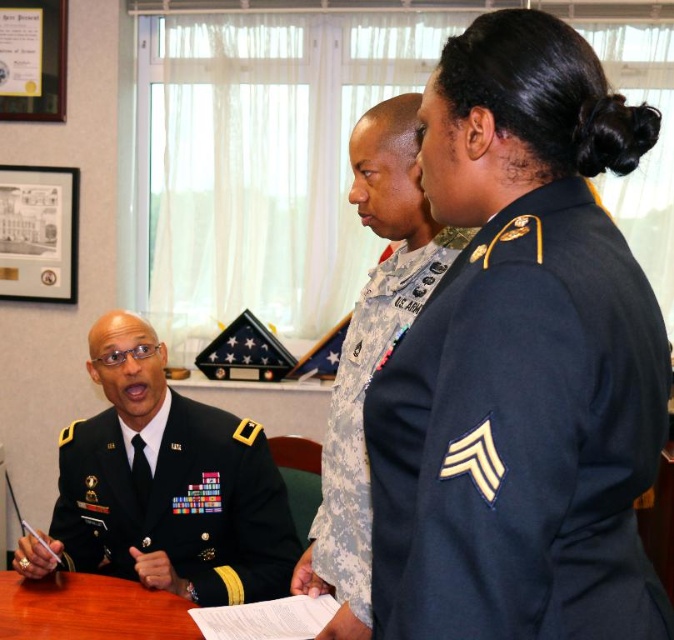
You are a photographer positioned at the entrance of the room. You need to take a photo that includes both the camouflage fabric uniform at center and the brown wooden table at center. Based on their positions, which object should be placed closer to the left side of the photo frame?

The brown wooden table at center should be placed closer to the left side of the photo frame because the camouflage fabric uniform at center is to the right of it.

You are a military assistant who needs to hand a document to both the navy blue fabric uniform at right and the dark green military uniform at left. Can you walk directly between them to deliver the document without needing to move either of them?

The navy blue fabric uniform at right and the dark green military uniform at left are 1.25 meters apart. Since the distance between them is sufficient, you can walk directly between them to deliver the document without needing to move either of them.

You are a photographer positioned to the left of the scene. You need to capture a photo that includes both the navy blue fabric uniform at right and the camouflage fabric uniform at center. Which uniform should you adjust your camera angle upwards to include in the frame?

The navy blue fabric uniform at right is located above the camouflage fabric uniform at center, so you should adjust your camera angle downwards to include the camouflage fabric uniform at center in the frame.